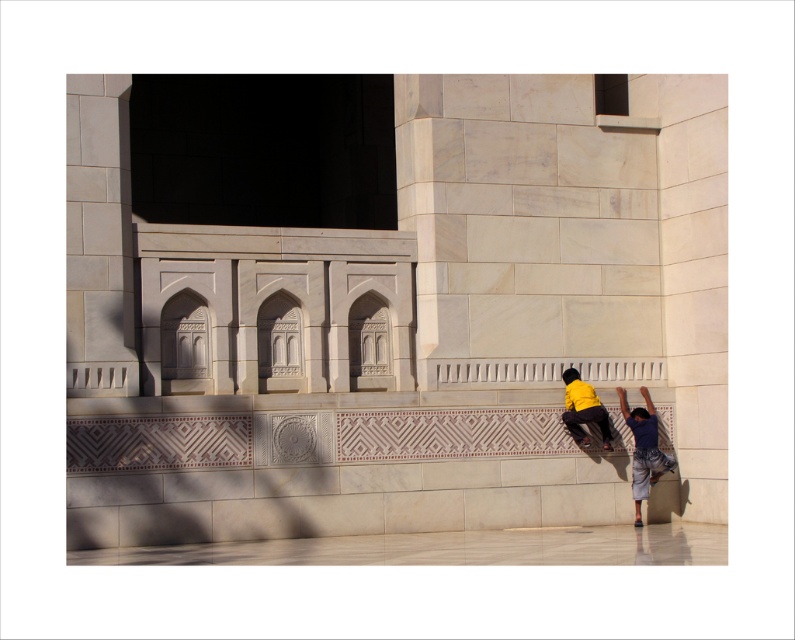
Question: Among these objects, which one is nearest to the camera?

Choices:
 (A) blue denim pants at lower right
 (B) yellow matte skateboard at lower center

Answer: (B)

Question: Can you confirm if blue denim pants at lower right is thinner than yellow matte skateboard at lower center?

Choices:
 (A) yes
 (B) no

Answer: (B)

Question: Can you confirm if blue denim pants at lower right is positioned above yellow matte skateboard at lower center?

Choices:
 (A) yes
 (B) no

Answer: (B)

Question: Is yellow matte skateboard at lower center smaller than black rubber skateboard at lower center?

Choices:
 (A) yes
 (B) no

Answer: (B)

Question: Among these points, which one is farthest from the camera?

Choices:
 (A) (576, 413)
 (B) (586, 448)

Answer: (B)

Question: Which point appears farthest from the camera in this image?

Choices:
 (A) (592, 420)
 (B) (582, 444)
 (C) (666, 456)

Answer: (C)